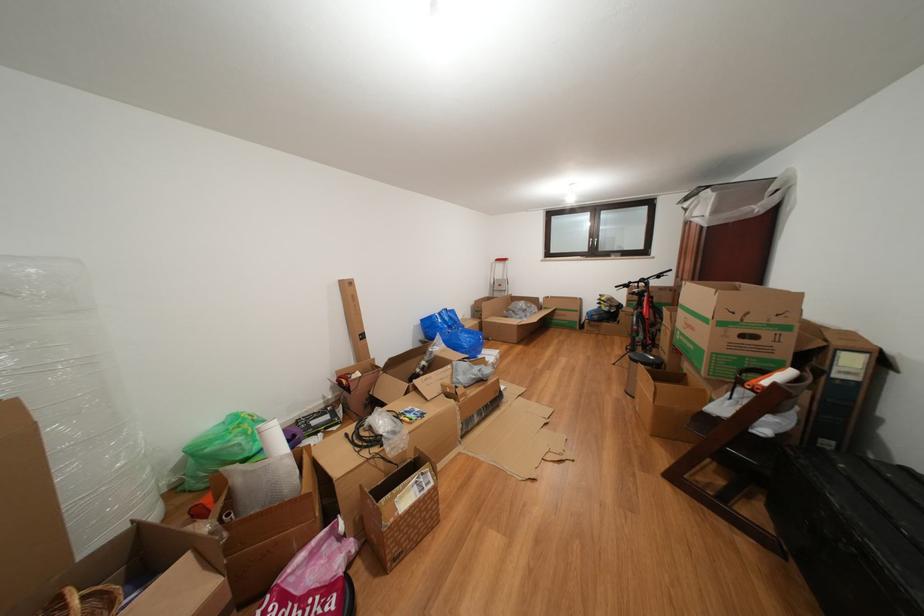
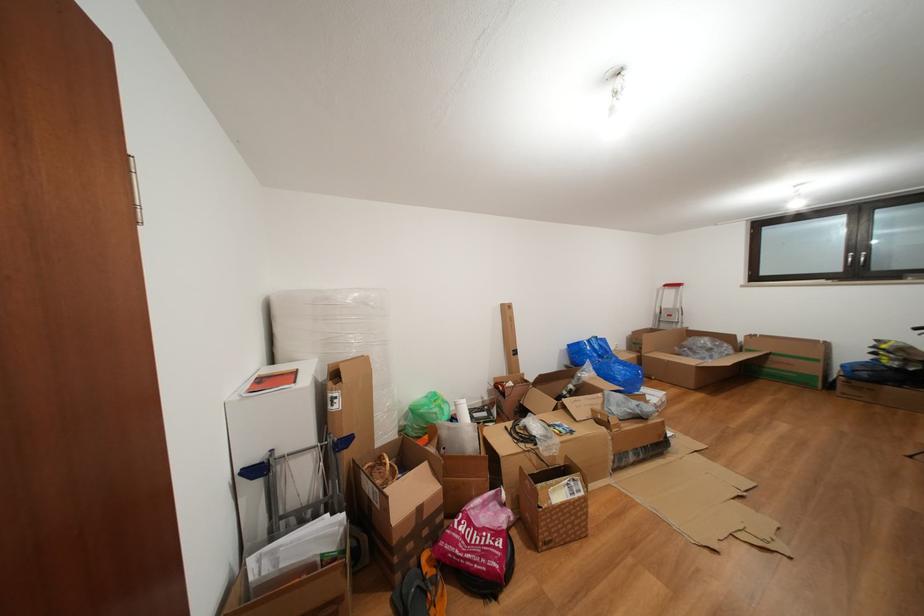
In the second image, find the point that corresponds to (x=585, y=315) in the first image.

(824, 366)